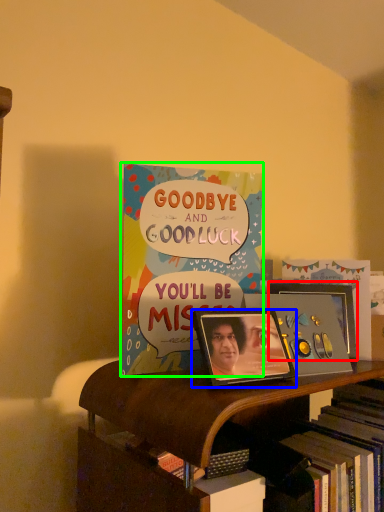
Question: Which object is the farthest from picture frame (highlighted by a red box)? Choose among these: picture frame (highlighted by a blue box) or book (highlighted by a green box).

Choices:
 (A) picture frame
 (B) book

Answer: (B)